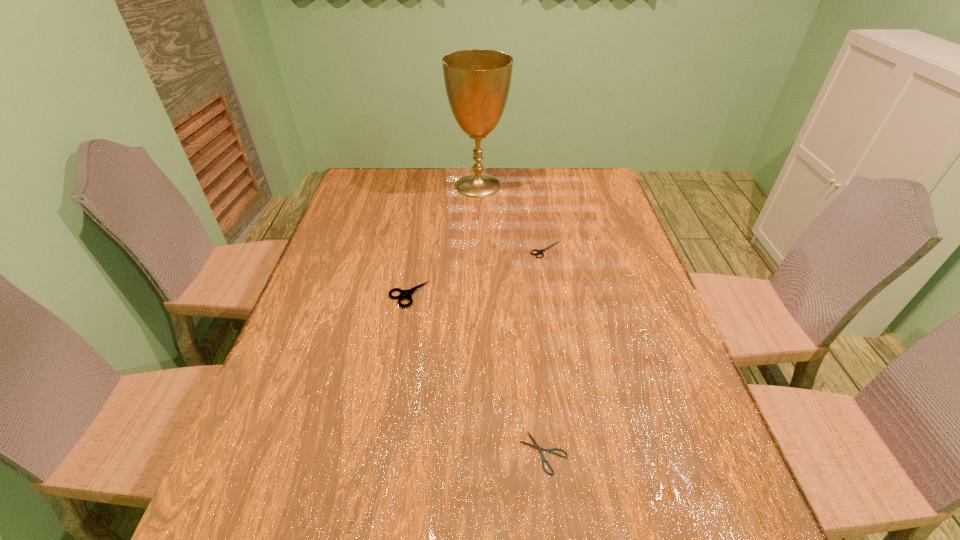
Locate an element on the screen. free point located on the left of the second tallest shears is located at coordinates (432, 249).

Identify the location of free space located 0.250m on the left of the shortest shears. (390, 453).

At what (x,y) coordinates should I click in order to perform the action: click on object at the far edge. Please return your answer as a coordinate pair (x, y). The image size is (960, 540). Looking at the image, I should click on (477, 81).

Where is `vacant space at the far edge of the desktop`? vacant space at the far edge of the desktop is located at coordinates click(404, 186).

Locate an element on the screen. The height and width of the screenshot is (540, 960). vacant area at the left edge is located at coordinates (275, 373).

At what (x,y) coordinates should I click in order to perform the action: click on vacant space at the right edge of the desktop. Please return your answer as a coordinate pair (x, y). This screenshot has width=960, height=540. Looking at the image, I should click on (664, 511).

In the image, there is a desktop. At what (x,y) coordinates should I click in order to perform the action: click on vacant space at the far left corner. Please return your answer as a coordinate pair (x, y). The width and height of the screenshot is (960, 540). Looking at the image, I should click on click(360, 182).

What are the coordinates of `vacant space at the far right corner` in the screenshot? It's located at (564, 178).

Where is `vacant space that is in between the trophy cup and the leftmost shears`? This screenshot has height=540, width=960. vacant space that is in between the trophy cup and the leftmost shears is located at coordinates (444, 240).

You are a GUI agent. You are given a task and a screenshot of the screen. Output one action in this format:
    pyautogui.click(x=<x>, y=<y>)
    Task: Click on the vacant region between the farthest object and the third shortest object
    The width and height of the screenshot is (960, 540).
    Given the screenshot: What is the action you would take?
    pyautogui.click(x=444, y=240)